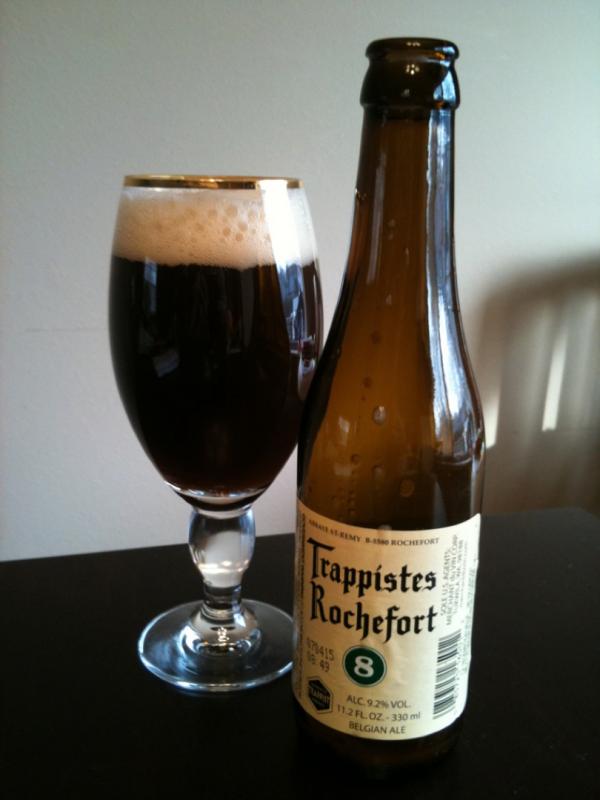
The image size is (600, 800). I want to click on wall, so click(529, 370), click(279, 524), click(84, 301), click(259, 73).